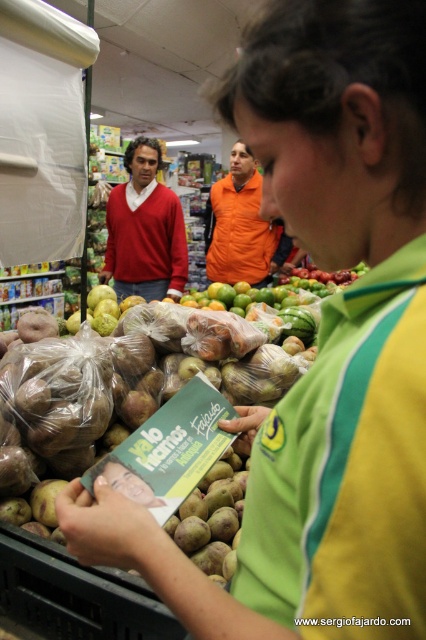
You are a customer in a store and you see the matte red sweater at upper left and the orange fabric shirt at center. You want to pick up both items to try them on. Can you reach both items at the same time if your arms can extend 20 inches apart?

The matte red sweater at upper left and orange fabric shirt at center are 20.17 inches apart from each other. Since your arms can only extend 20 inches, you cannot reach both items at the same time.

You are a customer in the store and want to determine which clothing item is wider between the matte red sweater at upper left and the orange fabric shirt at center. Which one is wider?

The matte red sweater at upper left is wider than the orange fabric shirt at center according to the description provided.